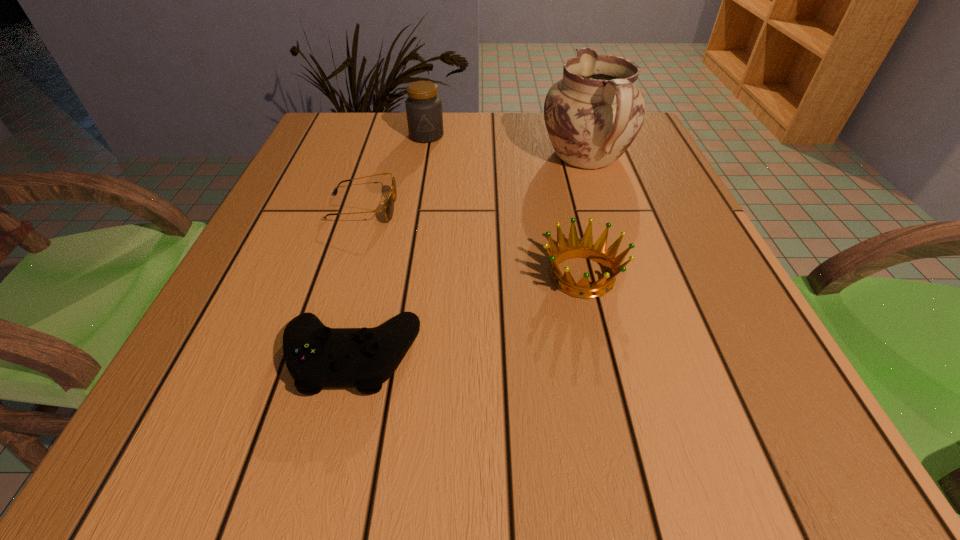
The image size is (960, 540). Identify the location of free spot located 0.130m on the right of the third tallest object. (700, 276).

This screenshot has width=960, height=540. In order to click on vacant space situated 0.090m on the front of the fourth tallest object in this screenshot , I will do `click(324, 470)`.

Identify the location of blank area located 0.150m on the lenses of the sunglasses. Image resolution: width=960 pixels, height=540 pixels. (470, 208).

This screenshot has width=960, height=540. Identify the location of pitcher at the far edge. (592, 115).

The image size is (960, 540). What are the coordinates of `jar present at the far edge` in the screenshot? It's located at (423, 107).

You are a GUI agent. You are given a task and a screenshot of the screen. Output one action in this format:
    pyautogui.click(x=<x>, y=<y>)
    Task: Click on the control located in the left edge section of the desktop
    
    Given the screenshot: What is the action you would take?
    pyautogui.click(x=317, y=357)

The height and width of the screenshot is (540, 960). I want to click on sunglasses present at the left edge, so click(x=389, y=206).

Find the location of a particular element. Image resolution: width=960 pixels, height=540 pixels. object that is at the right edge is located at coordinates (592, 115).

I want to click on object that is at the far right corner, so click(592, 115).

Find the location of `free space at the far edge`. free space at the far edge is located at coordinates (542, 132).